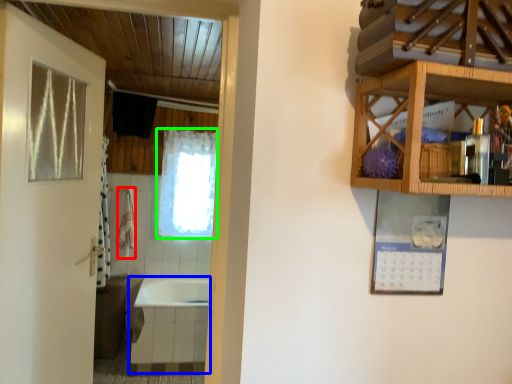
Question: Based on their relative distances, which object is nearer to towel/napkin (highlighted by a red box)? Choose from bath (highlighted by a blue box) and curtain (highlighted by a green box).

Choices:
 (A) bath
 (B) curtain

Answer: (B)